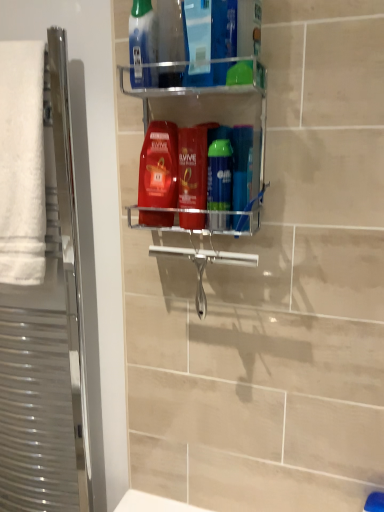
Question: From a real-world perspective, is silver metallic towel rack at left physically below green glossy mouthwash at center, the 3th mouthwash viewed from the left?

Choices:
 (A) no
 (B) yes

Answer: (B)

Question: Is silver metallic towel rack at left turned away from green glossy mouthwash at center, which appears as the 2th mouthwash when viewed from the right?

Choices:
 (A) no
 (B) yes

Answer: (A)

Question: Is silver metallic towel rack at left positioned beyond the bounds of green glossy mouthwash at center, the 3th mouthwash viewed from the left?

Choices:
 (A) yes
 (B) no

Answer: (A)

Question: Can you confirm if silver metallic towel rack at left is shorter than green glossy mouthwash at center, which appears as the 2th mouthwash when viewed from the right?

Choices:
 (A) yes
 (B) no

Answer: (B)

Question: Considering the relative sizes of silver metallic towel rack at left and green glossy mouthwash at center, which appears as the 2th mouthwash when viewed from the right, in the image provided, is silver metallic towel rack at left smaller than green glossy mouthwash at center, which appears as the 2th mouthwash when viewed from the right,?

Choices:
 (A) no
 (B) yes

Answer: (A)

Question: Considering the positions of shiny red shampoo at center and blue plastic toothbrush at center, placed as the first mouthwash when sorted from right to left, in the image, is shiny red shampoo at center taller or shorter than blue plastic toothbrush at center, placed as the first mouthwash when sorted from right to left,?

Choices:
 (A) short
 (B) tall

Answer: (B)

Question: From a real-world perspective, is shiny red shampoo at center above or below blue plastic toothbrush at center, the 4th mouthwash from the left?

Choices:
 (A) above
 (B) below

Answer: (A)

Question: Based on their sizes in the image, would you say shiny red shampoo at center is bigger or smaller than blue plastic toothbrush at center, placed as the first mouthwash when sorted from right to left?

Choices:
 (A) small
 (B) big

Answer: (B)

Question: In terms of width, does shiny red shampoo at center look wider or thinner when compared to blue plastic toothbrush at center, placed as the first mouthwash when sorted from right to left?

Choices:
 (A) wide
 (B) thin

Answer: (A)

Question: From a real-world perspective, is silver metallic towel rack at left physically located above or below blue plastic toothbrush at center, the 4th mouthwash from the left?

Choices:
 (A) below
 (B) above

Answer: (A)

Question: Considering the positions of silver metallic towel rack at left and blue plastic toothbrush at center, placed as the first mouthwash when sorted from right to left, in the image, is silver metallic towel rack at left taller or shorter than blue plastic toothbrush at center, placed as the first mouthwash when sorted from right to left,?

Choices:
 (A) short
 (B) tall

Answer: (B)

Question: Is point (49, 74) positioned closer to the camera than point (241, 188)?

Choices:
 (A) closer
 (B) farther

Answer: (B)

Question: Which is correct: silver metallic towel rack at left is inside blue plastic toothbrush at center, the 4th mouthwash from the left, or outside of it?

Choices:
 (A) inside
 (B) outside

Answer: (B)

Question: From the image's perspective, is silver metallic towel rack at left located above or below white soft towel at left?

Choices:
 (A) below
 (B) above

Answer: (A)

Question: Is silver metallic towel rack at left to the left or to the right of white soft towel at left in the image?

Choices:
 (A) right
 (B) left

Answer: (B)